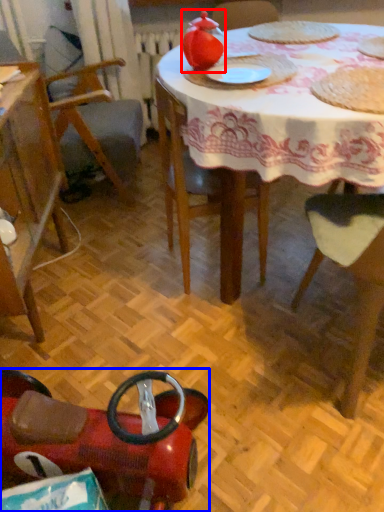
Question: Which of the following is the closest to the observer, tea pot (highlighted by a red box) or chair (highlighted by a blue box)?

Choices:
 (A) tea pot
 (B) chair

Answer: (B)